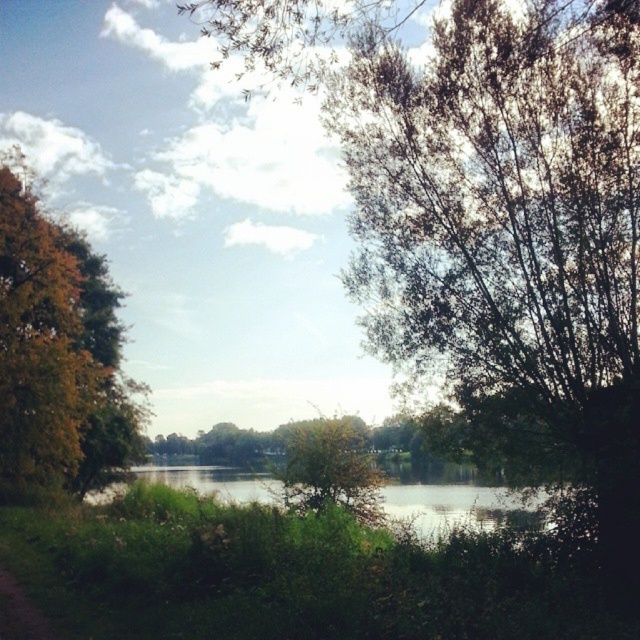
Is green grassy river at center to the right of green leafy tree at center from the viewer's perspective?

In fact, green grassy river at center is to the left of green leafy tree at center.

Between green grassy river at center and green leafy tree at center, which one appears on the right side from the viewer's perspective?

Positioned to the right is green leafy tree at center.

This screenshot has height=640, width=640. What do you see at coordinates (458, 500) in the screenshot? I see `green grassy river at center` at bounding box center [458, 500].

You are a GUI agent. You are given a task and a screenshot of the screen. Output one action in this format:
    pyautogui.click(x=<x>, y=<y>)
    Task: Click on the green grassy river at center
    
    Given the screenshot: What is the action you would take?
    pyautogui.click(x=458, y=500)

Which is above, orange leafy tree at left or green grassy river at center?

Positioned higher is orange leafy tree at left.

Is orange leafy tree at left behind green grassy river at center?

That is True.

Does point (36, 220) lie behind point (397, 509)?

Yes, it is behind point (397, 509).

At what (x,y) coordinates should I click in order to perform the action: click on orange leafy tree at left. Please return your answer as a coordinate pair (x, y). The height and width of the screenshot is (640, 640). Looking at the image, I should click on (58, 355).

Where is `orange leafy tree at left`? The width and height of the screenshot is (640, 640). orange leafy tree at left is located at coordinates (58, 355).